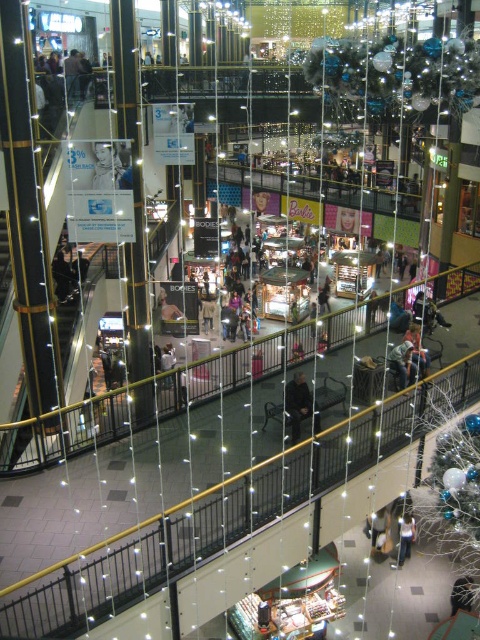
Question: Which of the following is the farthest from the observer?

Choices:
 (A) light blue denim jeans at lower center
 (B) dark gray jacket at center

Answer: (A)

Question: Among these points, which one is nearest to the camera?

Choices:
 (A) (405, 534)
 (B) (295, 372)

Answer: (A)

Question: Does dark gray jacket at center have a larger size compared to light blue denim jeans at lower center?

Choices:
 (A) yes
 (B) no

Answer: (A)

Question: Does dark gray jacket at center have a lesser width compared to light blue denim jeans at lower center?

Choices:
 (A) yes
 (B) no

Answer: (B)

Question: Can you confirm if dark gray jacket at center is positioned to the left of light blue denim jeans at lower center?

Choices:
 (A) no
 (B) yes

Answer: (B)